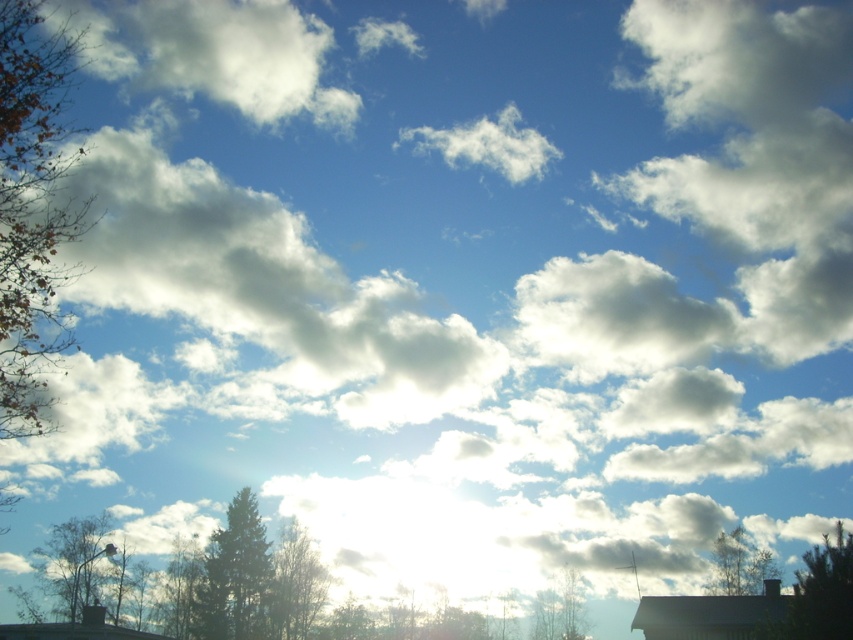
From the picture: Can you confirm if brown leafy tree at left is taller than green leafy tree at upper right?

Yes.

Which is in front, point (4, 365) or point (758, 588)?

Point (4, 365) is in front.

Between point (76, 211) and point (746, 577), which one is positioned in front?

Point (76, 211) is more forward.

You are a GUI agent. You are given a task and a screenshot of the screen. Output one action in this format:
    pyautogui.click(x=<x>, y=<y>)
    Task: Click on the brown leafy tree at left
    
    Given the screenshot: What is the action you would take?
    pyautogui.click(x=32, y=209)

Looking at this image, is white fluffy cloud at center to the right of green matte tree at lower center from the viewer's perspective?

In fact, white fluffy cloud at center is to the left of green matte tree at lower center.

Measure the distance from white fluffy cloud at center to green matte tree at lower center.

white fluffy cloud at center and green matte tree at lower center are 79.94 feet apart from each other.

Is point (407, 410) farther from viewer compared to point (219, 625)?

That is True.

Where is `white fluffy cloud at center`? This screenshot has width=853, height=640. white fluffy cloud at center is located at coordinates (267, 296).

What do you see at coordinates (32, 209) in the screenshot? Image resolution: width=853 pixels, height=640 pixels. I see `brown leafy tree at left` at bounding box center [32, 209].

Identify the location of brown leafy tree at left. (32, 209).